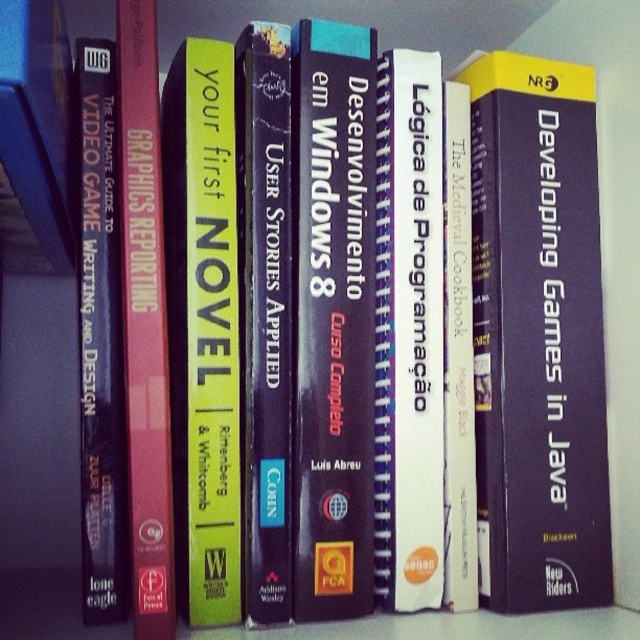
You are organizing a library shelf and need to place two books correctly according to their positions. The books are the purple hardcover book at center and the white matte book at center. Which book is positioned to the right of the other?

The purple hardcover book at center is to the right of the white matte book at center.

You are a librarian organizing items on a shelf. You have a matte black book at left and a white paper at center. The shelf is 20 inches wide. Can both items fit side by side without overlapping?

The matte black book at left and white paper at center are 15.82 inches apart. Since the shelf is 20 inches wide, there is enough space to place both items side by side without overlapping.